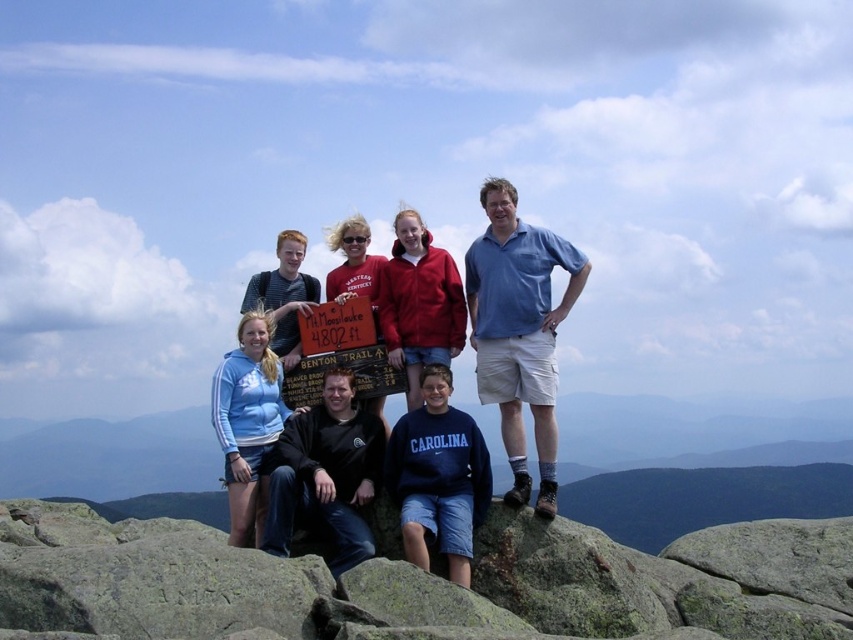
Between blue cotton shirt at center and black matte jacket at center, which one appears on the right side from the viewer's perspective?

From the viewer's perspective, blue cotton shirt at center appears more on the right side.

Can you confirm if blue cotton shirt at center is positioned to the left of black matte jacket at center?

In fact, blue cotton shirt at center is to the right of black matte jacket at center.

At what (x,y) coordinates should I click in order to perform the action: click on blue cotton shirt at center. Please return your answer as a coordinate pair (x, y). Looking at the image, I should click on (519, 332).

Can you confirm if black matte jacket at center is bigger than red fleece jacket at center?

Indeed, black matte jacket at center has a larger size compared to red fleece jacket at center.

What do you see at coordinates (326, 476) in the screenshot?
I see `black matte jacket at center` at bounding box center [326, 476].

Locate an element on the screen. Image resolution: width=853 pixels, height=640 pixels. black matte jacket at center is located at coordinates (326, 476).

Can you confirm if carved stone at lower center is positioned above blue cotton sweatshirt at center?

No, carved stone at lower center is not above blue cotton sweatshirt at center.

Is the position of carved stone at lower center less distant than that of blue cotton sweatshirt at center?

Yes, carved stone at lower center is in front of blue cotton sweatshirt at center.

Who is more distant from viewer, (x=4, y=544) or (x=433, y=506)?

The point (x=433, y=506) is behind.

You are a GUI agent. You are given a task and a screenshot of the screen. Output one action in this format:
    pyautogui.click(x=<x>, y=<y>)
    Task: Click on the carved stone at lower center
    
    Given the screenshot: What is the action you would take?
    pyautogui.click(x=422, y=580)